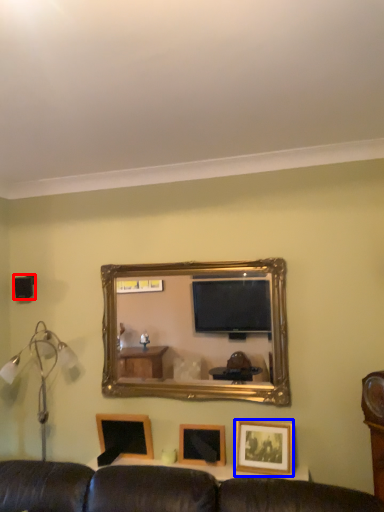
Question: Which of the following is the farthest to the observer, speaker (highlighted by a red box) or picture frame (highlighted by a blue box)?

Choices:
 (A) speaker
 (B) picture frame

Answer: (A)